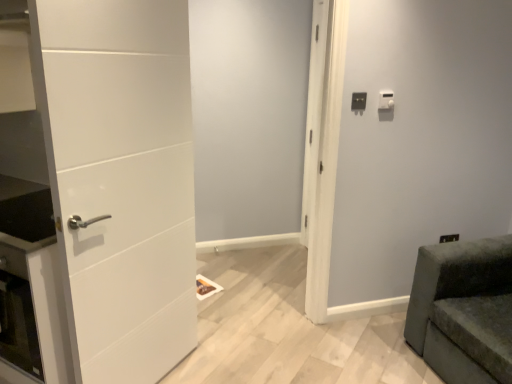
Question: Is white plastic light switch at upper right, the 2th light switch viewed from the right, located outside white matte door at center?

Choices:
 (A) no
 (B) yes

Answer: (B)

Question: Is white plastic light switch at upper right, the 2th light switch viewed from the right, surrounding white matte door at center?

Choices:
 (A) no
 (B) yes

Answer: (A)

Question: Considering the relative positions of white plastic light switch at upper right, the 2th light switch viewed from the right, and white matte door at center in the image provided, is white plastic light switch at upper right, the 2th light switch viewed from the right, to the right of white matte door at center from the viewer's perspective?

Choices:
 (A) no
 (B) yes

Answer: (B)

Question: Is white plastic light switch at upper right, the 2th light switch viewed from the right, thinner than white matte door at center?

Choices:
 (A) yes
 (B) no

Answer: (A)

Question: Is white plastic light switch at upper right, the 2th light switch viewed from the right, to the left of white matte door at center from the viewer's perspective?

Choices:
 (A) no
 (B) yes

Answer: (A)

Question: From the image's perspective, is white plastic light switch at upper right, the 2th light switch viewed from the right, on white matte door at center?

Choices:
 (A) yes
 (B) no

Answer: (A)

Question: Does white matte door at center have a larger size compared to white plastic light switch at upper right, arranged as the 1th light switch when viewed from the left?

Choices:
 (A) yes
 (B) no

Answer: (A)

Question: Is white matte door at center at the right side of white plastic light switch at upper right, the 2th light switch viewed from the right?

Choices:
 (A) no
 (B) yes

Answer: (A)

Question: Considering the relative sizes of white matte door at center and white plastic light switch at upper right, the 2th light switch viewed from the right, in the image provided, is white matte door at center thinner than white plastic light switch at upper right, the 2th light switch viewed from the right,?

Choices:
 (A) yes
 (B) no

Answer: (B)

Question: From a real-world perspective, is white matte door at center under white plastic light switch at upper right, the 2th light switch viewed from the right?

Choices:
 (A) no
 (B) yes

Answer: (B)

Question: Is white plastic light switch at upper right, the 2th light switch viewed from the right, at the back of white matte door at center?

Choices:
 (A) no
 (B) yes

Answer: (A)

Question: Is white matte door at center oriented towards white plastic light switch at upper right, the 2th light switch viewed from the right?

Choices:
 (A) yes
 (B) no

Answer: (B)

Question: Considering the relative sizes of white matte door at left and white plastic light switch at upper right, the 1th light switch viewed from the right, in the image provided, is white matte door at left shorter than white plastic light switch at upper right, the 1th light switch viewed from the right,?

Choices:
 (A) no
 (B) yes

Answer: (A)